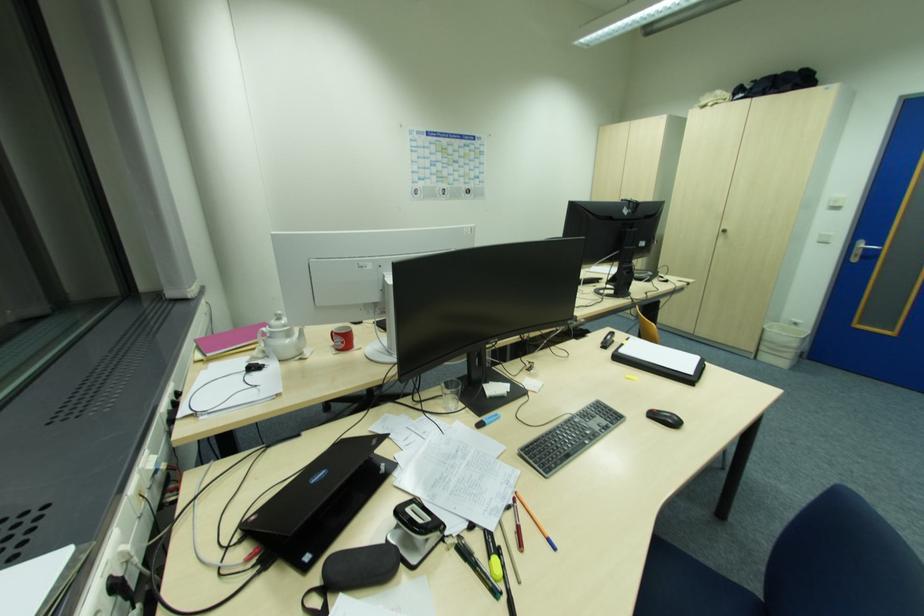
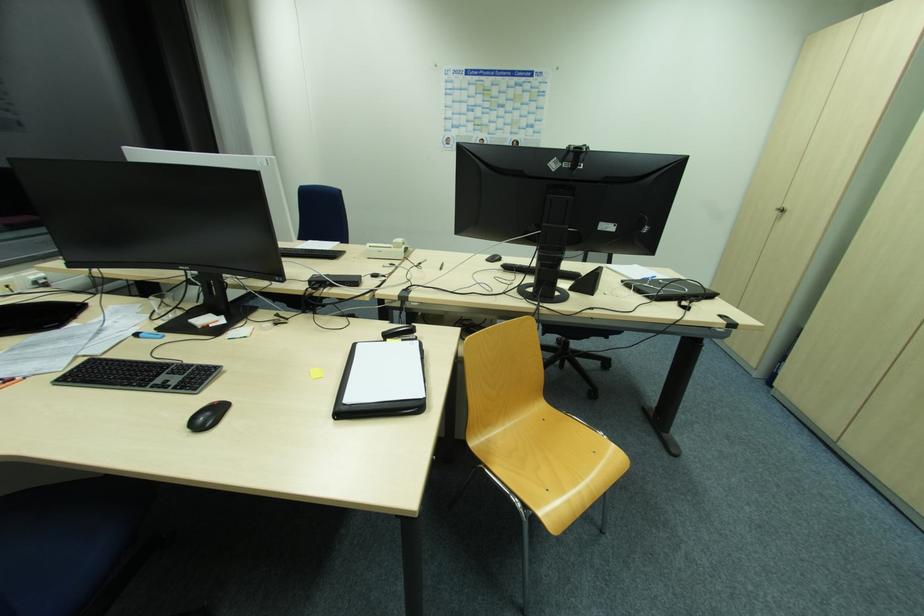
Find the pixel in the second image that matches pixel 627 209 in the first image.

(557, 159)